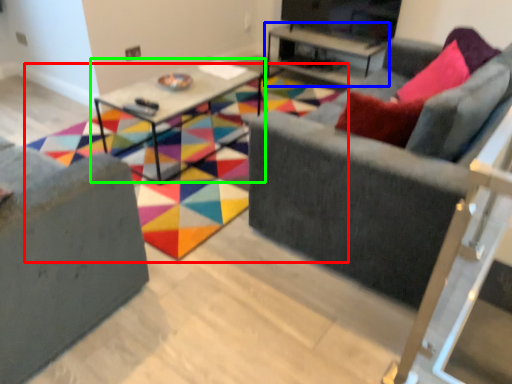
Question: Based on their relative distances, which object is nearer to pattern (highlighted by a red box)? Choose from table (highlighted by a blue box) and table (highlighted by a green box).

Choices:
 (A) table
 (B) table

Answer: (B)